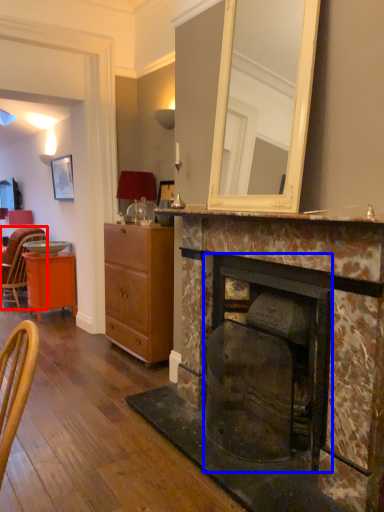
Question: Which object appears closest to the camera in this image, chair (highlighted by a red box) or fireplace (highlighted by a blue box)?

Choices:
 (A) chair
 (B) fireplace

Answer: (B)